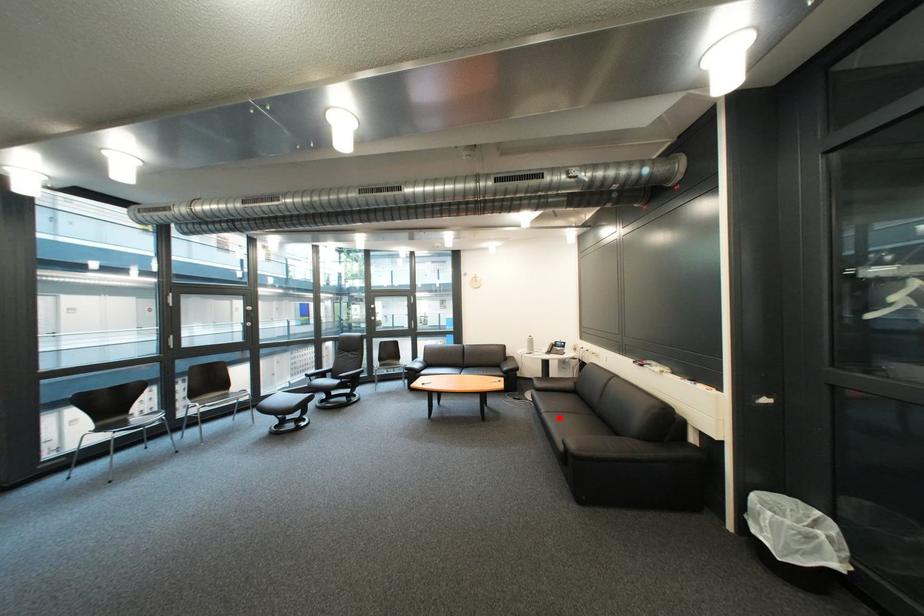
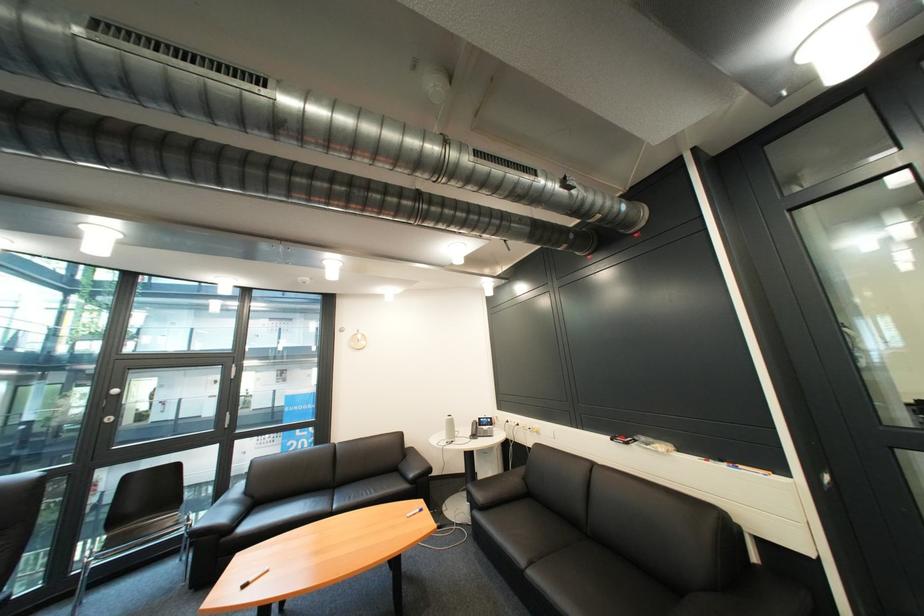
Locate, in the second image, the point that corresponds to the highlighted location in the first image.

(546, 577)